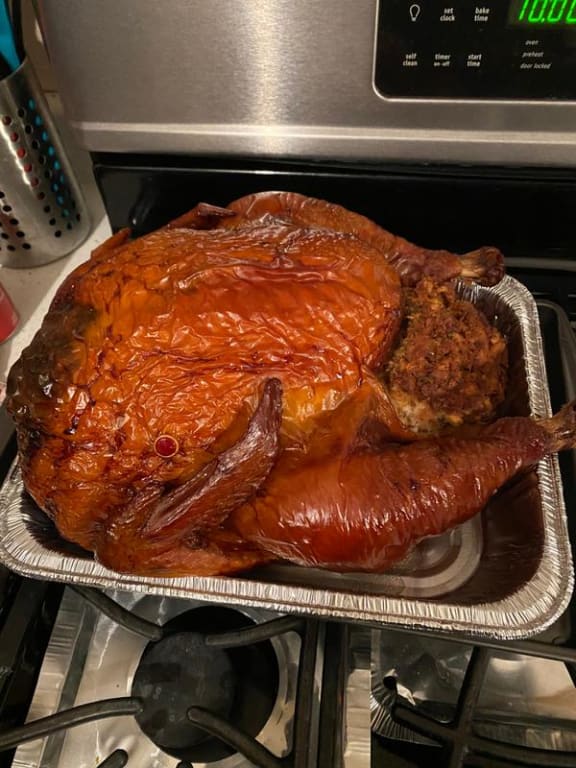
I want to click on burner, so click(x=200, y=657).